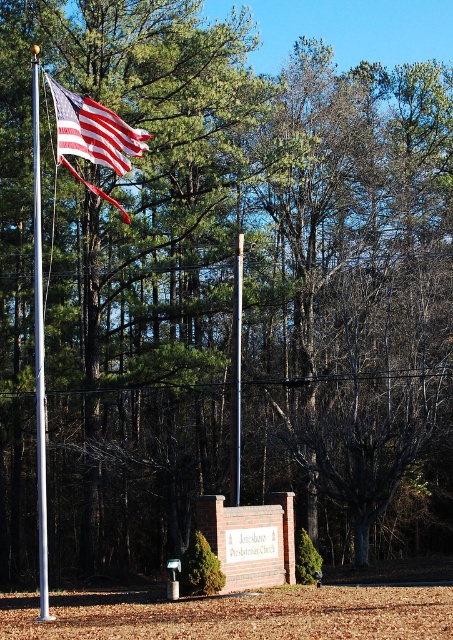
You are a photographer planning to capture the american flag at left and the polished metal flag pole at left in a single frame. Based on their widths, which object will appear narrower in the photo?

The american flag at left has a lesser width compared to the polished metal flag pole at left, so it will appear narrower in the photo.

You are standing in the outdoor area and want to hang a new smaller flag below the american flag at left. Can you do this without moving the polished metal flag pole at left?

The american flag at left is positioned over the polished metal flag pole at left, so there is space below it to hang a smaller flag without moving the pole.

You are standing in the outdoor scene and want to walk from point A to point B. Point A is located at coordinates point (120, 120) and point B is at point (38, 346). Which point is closer to you when you start walking?

Point A at point (120, 120) is closer to you because it is further to the viewer than point B at point (38, 346), meaning it is nearer in the scene.